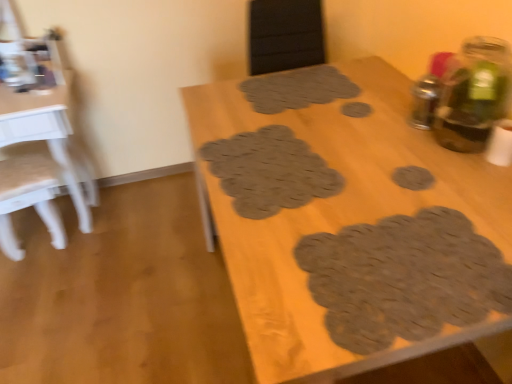
Where is `free spot above brown textured mat at bottom right, which is the 1th footprint in front-to-back order (from a real-world perspective)`? Image resolution: width=512 pixels, height=384 pixels. free spot above brown textured mat at bottom right, which is the 1th footprint in front-to-back order (from a real-world perspective) is located at coordinates (410, 269).